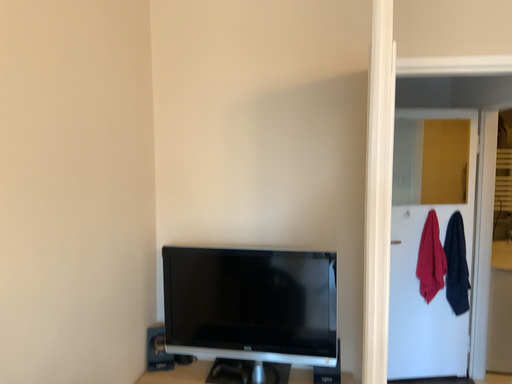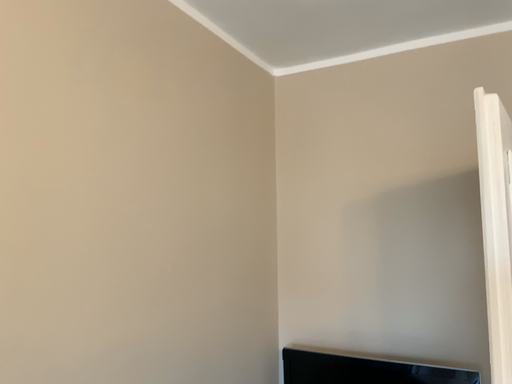
Question: Which way did the camera rotate in the video?

Choices:
 (A) rotated right
 (B) rotated left

Answer: (B)